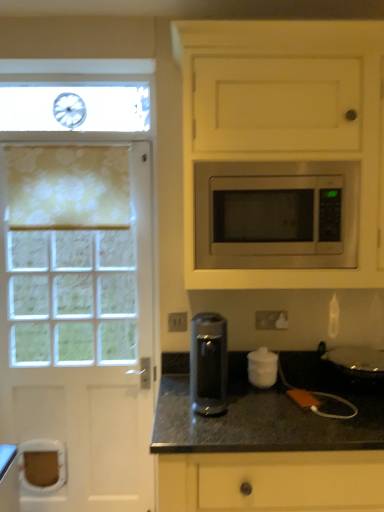
Question: Is sleek metallic coffee maker at center in front of yellow floral fabric at left?

Choices:
 (A) yes
 (B) no

Answer: (A)

Question: Is sleek metallic coffee maker at center looking in the opposite direction of yellow floral fabric at left?

Choices:
 (A) yes
 (B) no

Answer: (B)

Question: Is sleek metallic coffee maker at center thinner than yellow floral fabric at left?

Choices:
 (A) yes
 (B) no

Answer: (B)

Question: Considering the relative sizes of sleek metallic coffee maker at center and yellow floral fabric at left in the image provided, is sleek metallic coffee maker at center taller than yellow floral fabric at left?

Choices:
 (A) no
 (B) yes

Answer: (A)

Question: Is sleek metallic coffee maker at center further to the viewer compared to yellow floral fabric at left?

Choices:
 (A) yes
 (B) no

Answer: (B)

Question: Is yellow floral fabric at left completely or partially inside sleek metallic coffee maker at center?

Choices:
 (A) yes
 (B) no

Answer: (B)

Question: Is white matte sugar container at center facing away from sleek metallic coffee maker at center?

Choices:
 (A) no
 (B) yes

Answer: (A)

Question: Does white matte sugar container at center contain sleek metallic coffee maker at center?

Choices:
 (A) no
 (B) yes

Answer: (A)

Question: Considering the relative sizes of white matte sugar container at center and sleek metallic coffee maker at center in the image provided, is white matte sugar container at center taller than sleek metallic coffee maker at center?

Choices:
 (A) no
 (B) yes

Answer: (A)

Question: From the image's perspective, is white matte sugar container at center over sleek metallic coffee maker at center?

Choices:
 (A) yes
 (B) no

Answer: (B)

Question: Could you tell me if white matte sugar container at center is turned towards sleek metallic coffee maker at center?

Choices:
 (A) no
 (B) yes

Answer: (A)

Question: Does white matte sugar container at center appear on the right side of sleek metallic coffee maker at center?

Choices:
 (A) yes
 (B) no

Answer: (A)

Question: Does sleek metallic coffee maker at center have a smaller size compared to white matte sugar container at center?

Choices:
 (A) no
 (B) yes

Answer: (A)